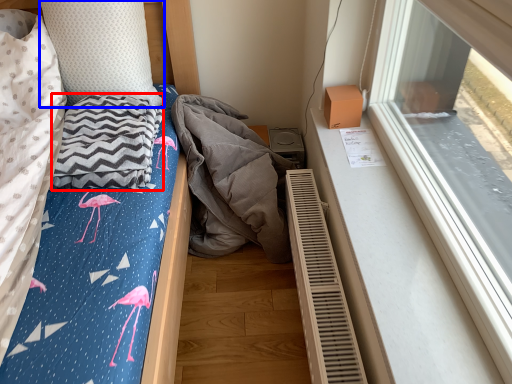
Question: Which object is closer to the camera taking this photo, blanket (highlighted by a red box) or pillow (highlighted by a blue box)?

Choices:
 (A) blanket
 (B) pillow

Answer: (A)